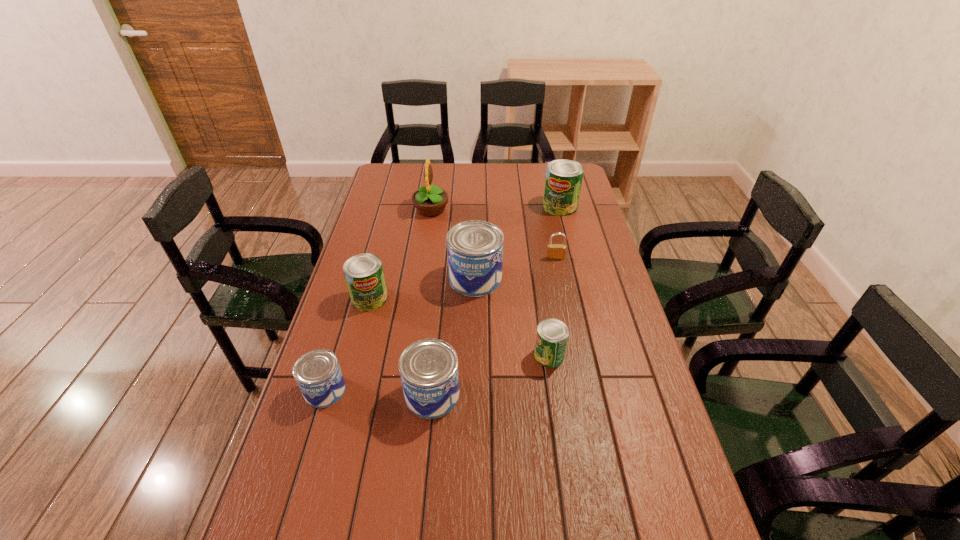
The width and height of the screenshot is (960, 540). I want to click on vacant space located 0.160m on the front label of the smallest blue can, so click(406, 390).

Identify the location of can positioned at the right edge. point(563,181).

Where is `padlock that is at the right edge`? This screenshot has width=960, height=540. padlock that is at the right edge is located at coordinates (554, 251).

In the image, there is a desktop. In order to click on free region at the far edge in this screenshot , I will do `click(479, 185)`.

This screenshot has width=960, height=540. Identify the location of vacant space at the left edge of the desktop. (364, 314).

Locate an element on the screen. The image size is (960, 540). vacant area at the right edge is located at coordinates (620, 312).

I want to click on free space at the far left corner, so click(x=412, y=175).

This screenshot has height=540, width=960. What are the coordinates of `free space between the second biggest blue can and the leftmost green can` in the screenshot? It's located at (401, 347).

What are the coordinates of `free spot between the yellow sunflower and the second nearest green can` in the screenshot? It's located at (400, 254).

Locate an element on the screen. free space between the brass padlock and the farthest blue can is located at coordinates [x=516, y=268].